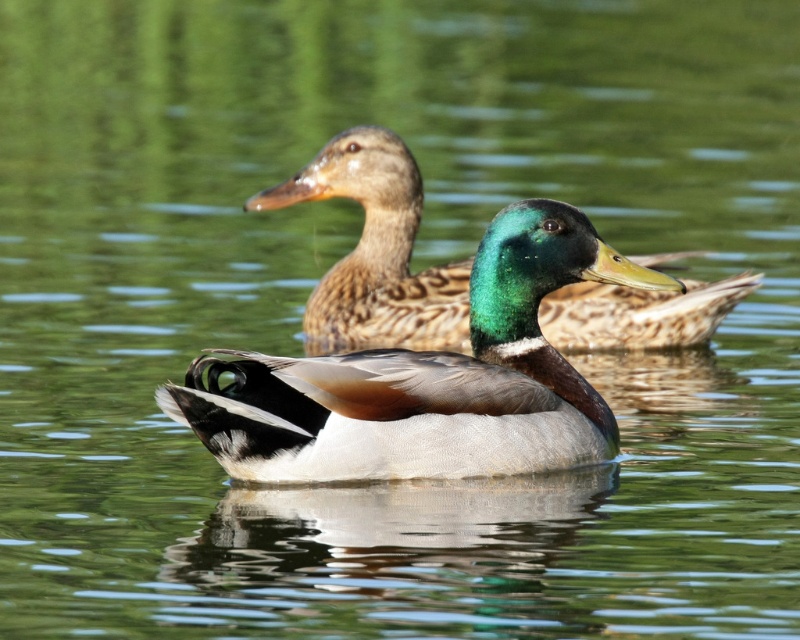
Which is more to the left, shiny green head at center or green glossy head at center?

green glossy head at center is more to the left.

Is shiny green head at center bigger than green glossy head at center?

Indeed, shiny green head at center has a larger size compared to green glossy head at center.

This screenshot has width=800, height=640. What are the coordinates of `shiny green head at center` in the screenshot? It's located at (428, 380).

Identify the location of shiny green head at center. (428, 380).